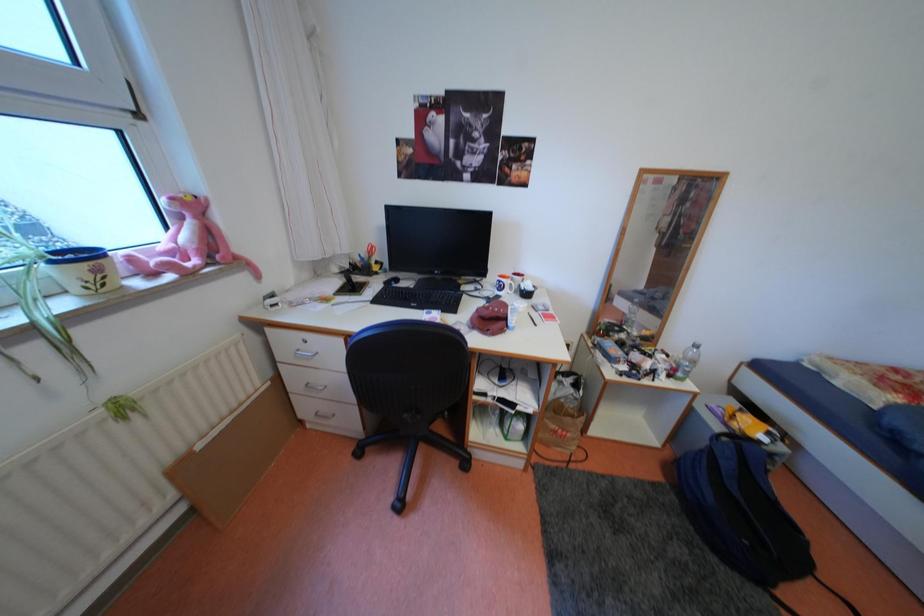
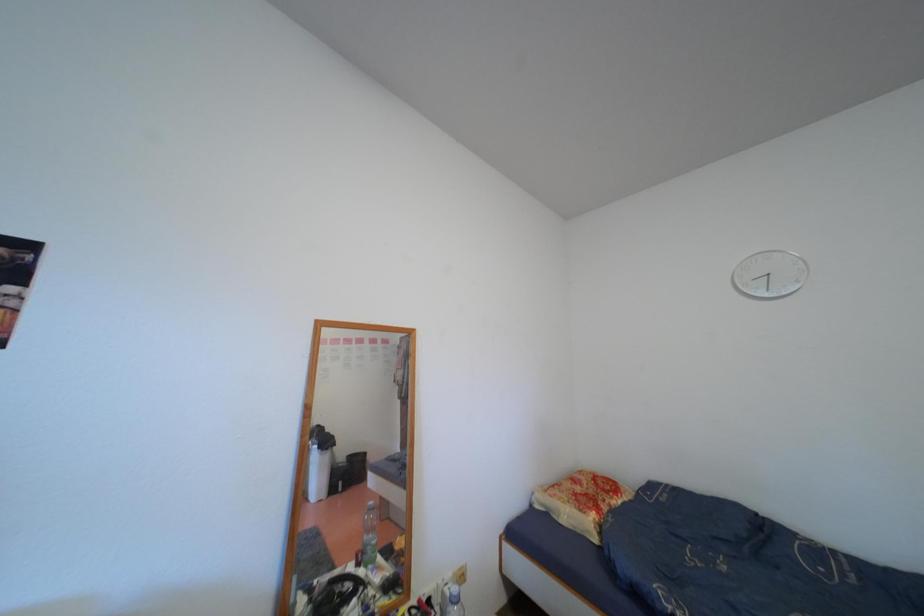
First-person continuous shooting, in which direction is the camera rotating?

The rotation direction of the camera is right-up.